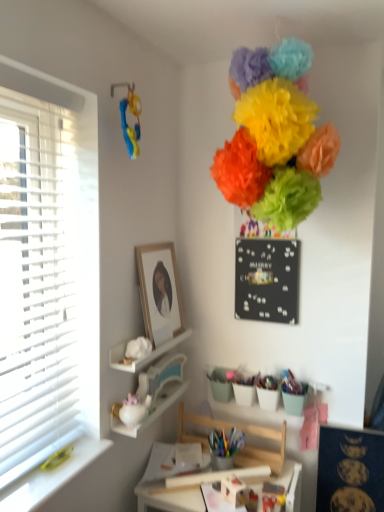
Question: Is wooden swivel chair at center situated inside white glossy teapot at lower left, marked as the 1th shelf in a bottom-to-top arrangement, or outside?

Choices:
 (A) outside
 (B) inside

Answer: (A)

Question: Looking at the image, does wooden swivel chair at center seem bigger or smaller compared to white glossy teapot at lower left, acting as the second shelf starting from the top?

Choices:
 (A) small
 (B) big

Answer: (B)

Question: Estimate the real-world distances between objects in this image. Which object is farther from the wooden framed portrait at upper center?

Choices:
 (A) wooden desk at center
 (B) white glossy teapot at lower left, acting as the second shelf starting from the top
 (C) dark blue matte bulletin board at upper right, which is counted as the 1th bulletin board, starting from the bottom
 (D) wooden swivel chair at center
 (E) black matte bulletin board at upper center, positioned as the 2th bulletin board in bottom-to-top order

Answer: (C)

Question: Estimate the real-world distances between objects in this image. Which object is closer to the white matte shelf at lower center, the 1th shelf in the top-to-bottom sequence?

Choices:
 (A) wooden framed portrait at upper center
 (B) matte paper pom-poms at upper center
 (C) wooden desk at center
 (D) wooden swivel chair at center
 (E) dark blue matte bulletin board at upper right, which appears as the second bulletin board when viewed from the left

Answer: (A)